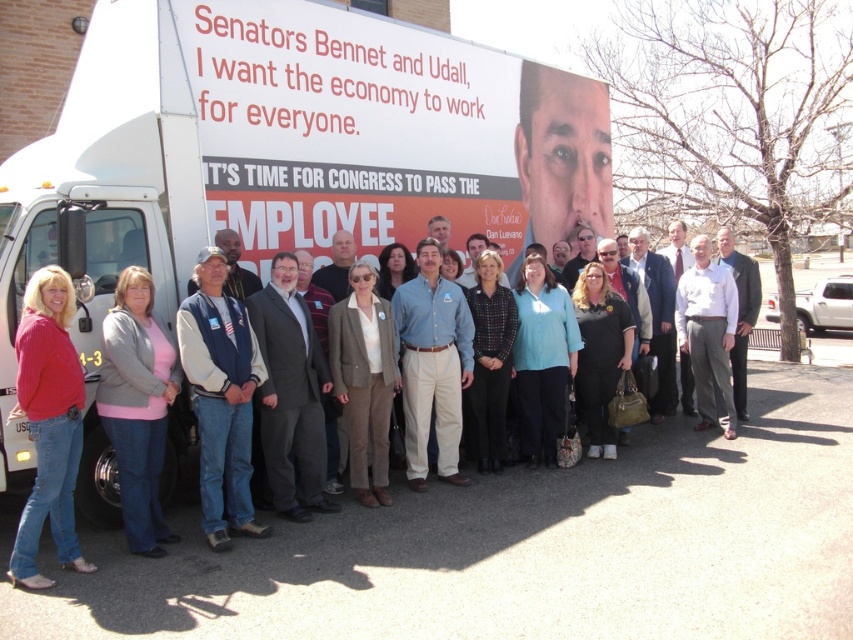
You are a photographer trying to capture a clear photo of the dark gray suit at center without the denim jacket at center blocking it. What should you do?

The denim jacket at center is in front of the dark gray suit at center, so you should move the denim jacket at center out of the way or adjust your angle to avoid the obstruction.

You are a photographer standing in front of the truck. You want to take a photo of the smooth skin face at center and the brown wool blazer at center. The minimum distance between the two objects in the photo should be 10 feet. Can you capture both in a single photo without moving either object?

The smooth skin face at center and brown wool blazer at center are 13.09 feet apart from each other, so yes, you can capture both in a single photo since the distance between them is more than the required 10 feet.

Looking at the scene of the truck with the political ad, you notice the smooth skin face at center and the blue denim shirt at center. Which object is positioned higher in the image?

The smooth skin face at center is above the blue denim shirt at center in the image.